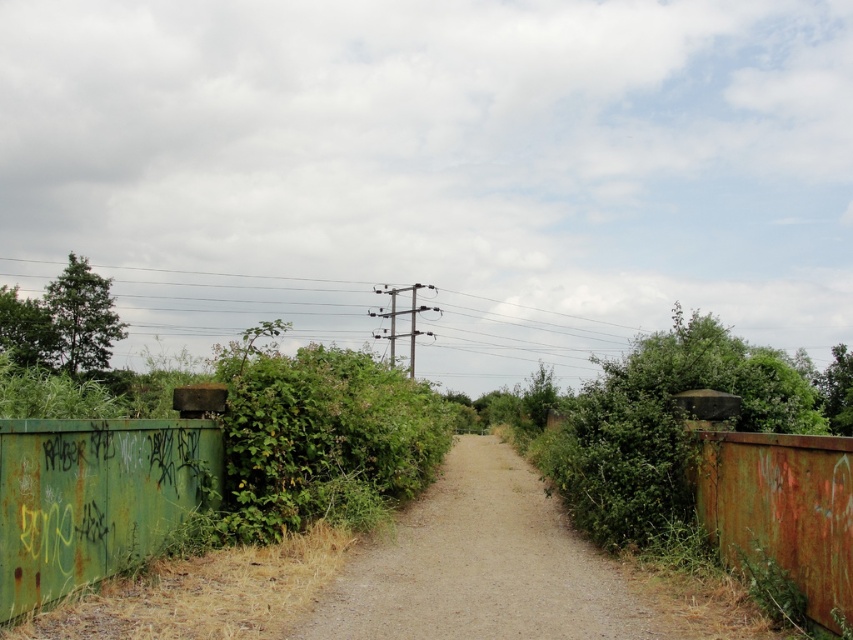
You are a hiker carrying a 2.5 meter wide tent. You see the brown gravel path at center and the rusty metal fence at right. Can you determine if your tent can fit across the path without crossing the fence?

The brown gravel path at center is wider than the rusty metal fence at right. However, the question is about fitting a 2.5 meter wide tent across the path. Since the path is wider than the fence, but we don not have exact measurements, we cannot definitively determine if the path is wide enough for the tent. More information is needed.

You are standing at the start of the path and want to reach a point exactly 15 feet away from you. The rusty green metal fence at lower left is in your path. Can you safely walk past it without getting closer than 5 feet to the fence?

The rusty green metal fence at lower left is 16.68 feet away from the viewer. Since you want to reach a point exactly 15 feet away, which is closer than the fence, you cannot safely walk past it without getting closer than 5 feet to the fence.

You are a hiker walking along the brown gravel path at center and notice the rusty green metal fence at lower left. From your perspective, which object is closer to you?

The brown gravel path at center is closer to you because the rusty green metal fence at lower left is behind it.